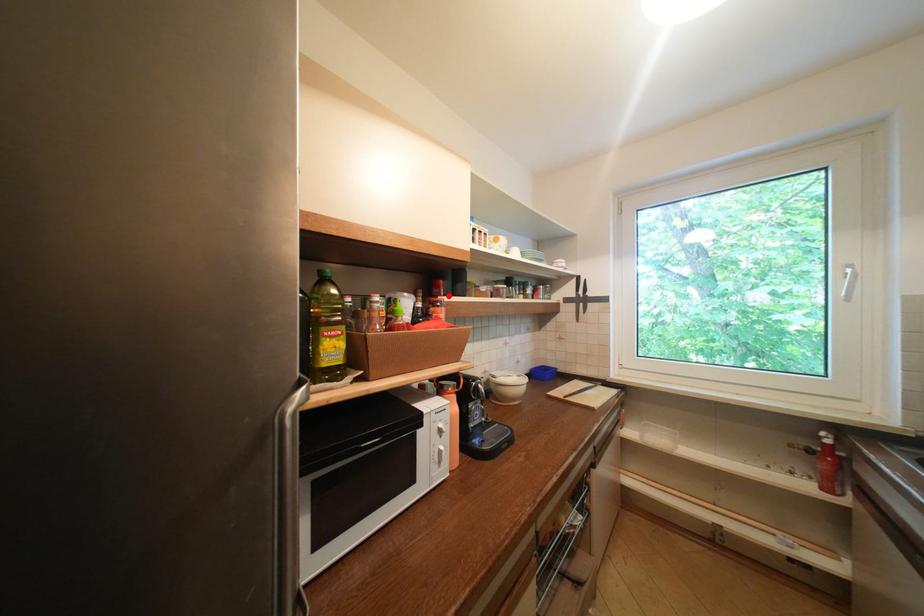
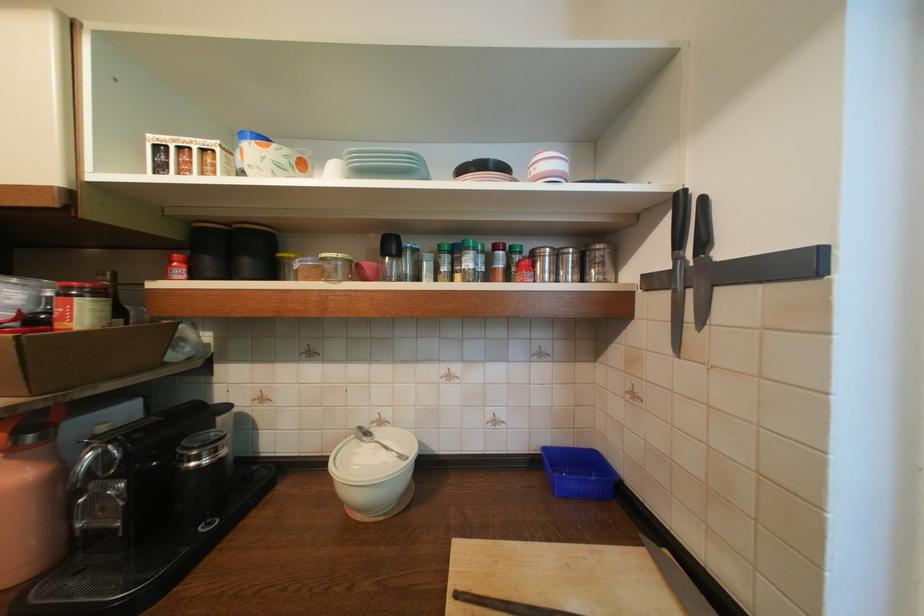
Where in the second image is the point corresponding to the highlighted location from the first image?

(174, 278)